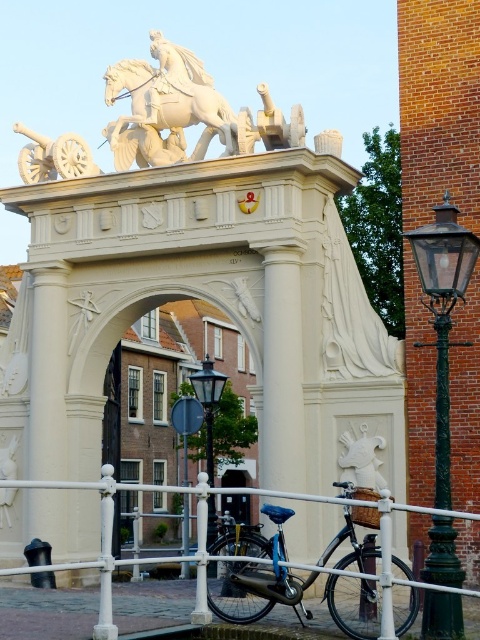
Which is above, green cast iron streetlight at right or black glass lamp post at center?

green cast iron streetlight at right is higher up.

Who is positioned more to the right, green cast iron streetlight at right or black glass lamp post at center?

green cast iron streetlight at right

Where is `green cast iron streetlight at right`? green cast iron streetlight at right is located at coordinates (443, 314).

Between white metal fence at lower center and white matte gate at center, which one is positioned lower?

Positioned lower is white metal fence at lower center.

Is point (208, 620) behind point (120, 531)?

No, it is in front of (120, 531).

Is point (79, 483) behind point (113, 472)?

No, (79, 483) is closer to viewer.

Locate an element on the screen. white metal fence at lower center is located at coordinates (100, 541).

Image resolution: width=480 pixels, height=640 pixels. What do you see at coordinates (100, 541) in the screenshot?
I see `white metal fence at lower center` at bounding box center [100, 541].

Does white metal fence at lower center have a lesser height compared to black glass lamp post at center?

No.

Does point (456, 513) come behind point (212, 394)?

No, it is in front of (212, 394).

You are a GUI agent. You are given a task and a screenshot of the screen. Output one action in this format:
    pyautogui.click(x=<x>, y=<y>)
    Task: Click on the white metal fence at lower center
    The image size is (480, 640).
    Given the screenshot: What is the action you would take?
    pyautogui.click(x=100, y=541)